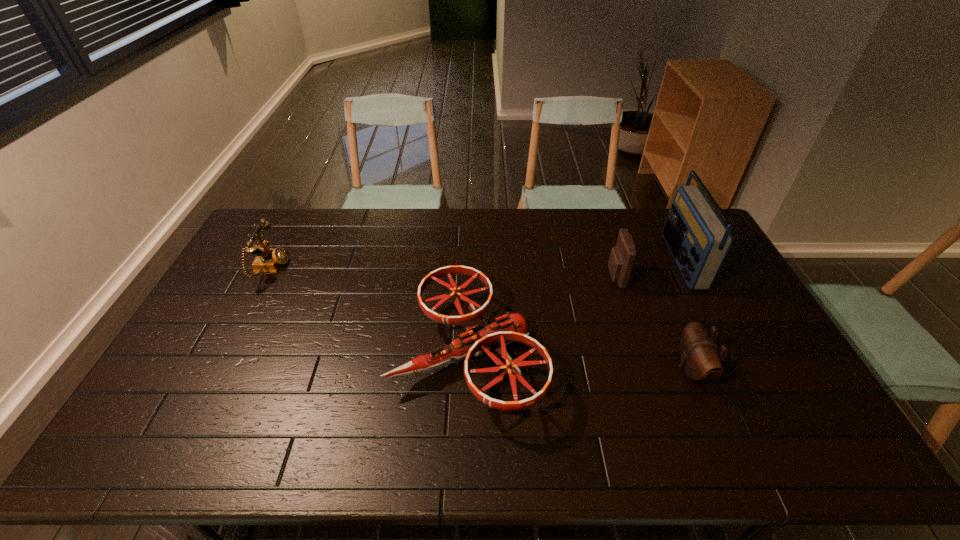
Image resolution: width=960 pixels, height=540 pixels. Identify the location of free point between the second object from right to left and the drone. point(580,360).

Identify the location of unoccupied position between the tallest object and the telephone. (476, 265).

You are a GUI agent. You are given a task and a screenshot of the screen. Output one action in this format:
    pyautogui.click(x=<x>, y=<y>)
    Task: Click on the free space that is in between the rightmost object and the right pouch
    
    Given the screenshot: What is the action you would take?
    pyautogui.click(x=686, y=315)

This screenshot has width=960, height=540. Identify the location of free space between the left pouch and the right pouch. (654, 323).

Where is `empty space between the tallest object and the fourth object from left to right`? The image size is (960, 540). empty space between the tallest object and the fourth object from left to right is located at coordinates (686, 315).

Where is `object that is the second closest to the rightmost object`? Image resolution: width=960 pixels, height=540 pixels. object that is the second closest to the rightmost object is located at coordinates (699, 358).

Locate an element on the screen. This screenshot has width=960, height=540. object that is the fourth closest one to the third object from left to right is located at coordinates (x=268, y=260).

At what (x,y) coordinates should I click in order to perform the action: click on blank space that satisfies the following two spatial constraints: 1. on the dial number of the leftmost object; 2. on the back side of the fourth object from right to left. Please return your answer as a coordinate pair (x, y). This screenshot has height=540, width=960. Looking at the image, I should click on (228, 352).

Locate an element on the screen. free space that satisfies the following two spatial constraints: 1. with an open flap on the farther pouch; 2. on the front side of the drone is located at coordinates (639, 352).